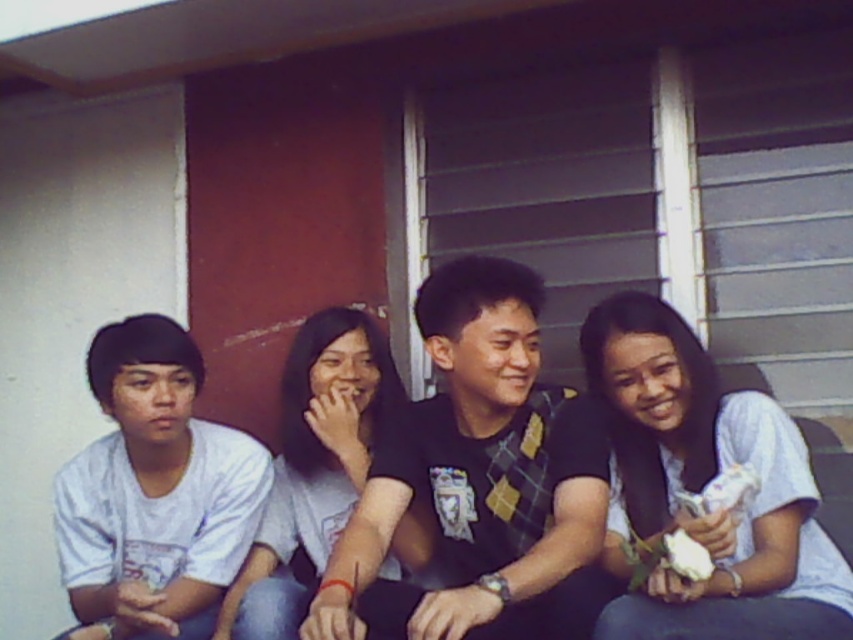
Question: Which object is the farthest from the white cotton shirt at right?

Choices:
 (A) black matte shirt at center
 (B) light blue t-shirt at center

Answer: (B)

Question: Estimate the real-world distances between objects in this image. Which object is farther from the white cotton shirt at right?

Choices:
 (A) light blue t-shirt at center
 (B) black matte shirt at center

Answer: (A)

Question: From the image, what is the correct spatial relationship of black matte shirt at center in relation to white cotton shirt at right?

Choices:
 (A) above
 (B) below

Answer: (A)

Question: Can you confirm if white cotton shirt at right is positioned below light blue t-shirt at center?

Choices:
 (A) no
 (B) yes

Answer: (A)

Question: In this image, where is black matte shirt at center located relative to white cotton shirt at right?

Choices:
 (A) above
 (B) below

Answer: (A)

Question: Which object is farther from the camera taking this photo?

Choices:
 (A) black matte shirt at center
 (B) white cotton shirt at right
 (C) light blue t-shirt at center

Answer: (C)